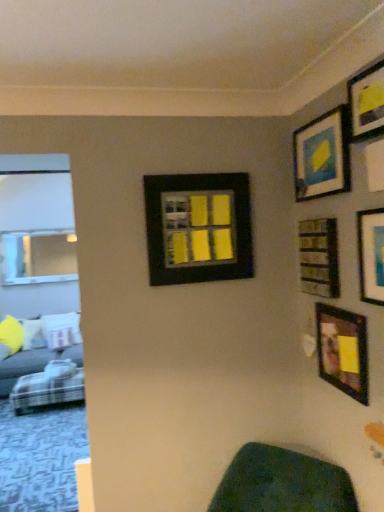
Question: Does black matte picture frame at center, which is counted as the sixth picture frame, starting from the right, have a lesser width compared to plaid fabric couch at lower left?

Choices:
 (A) no
 (B) yes

Answer: (B)

Question: Is black matte picture frame at center, the 1th picture frame in the left-to-right sequence, positioned before plaid fabric couch at lower left?

Choices:
 (A) no
 (B) yes

Answer: (B)

Question: Considering the relative sizes of black matte picture frame at center, which is counted as the sixth picture frame, starting from the right, and plaid fabric couch at lower left in the image provided, is black matte picture frame at center, which is counted as the sixth picture frame, starting from the right, taller than plaid fabric couch at lower left?

Choices:
 (A) no
 (B) yes

Answer: (B)

Question: Is black matte picture frame at center, which is counted as the sixth picture frame, starting from the right, not close to plaid fabric couch at lower left?

Choices:
 (A) no
 (B) yes

Answer: (B)

Question: Is black matte picture frame at center, the 1th picture frame in the left-to-right sequence, aimed at plaid fabric couch at lower left?

Choices:
 (A) yes
 (B) no

Answer: (B)

Question: Is black matte picture frame at center, the 1th picture frame in the left-to-right sequence, positioned with its back to plaid fabric couch at lower left?

Choices:
 (A) yes
 (B) no

Answer: (B)

Question: Is matte black picture frame at upper right, which appears as the second picture frame when viewed from the right, at the back of matte black picture frame at upper right, the 5th picture frame in the right-to-left sequence?

Choices:
 (A) yes
 (B) no

Answer: (B)

Question: Is matte black picture frame at upper right, which is counted as the second picture frame, starting from the left, at the left side of matte black picture frame at upper right, which appears as the second picture frame when viewed from the right?

Choices:
 (A) no
 (B) yes

Answer: (B)

Question: From a real-world perspective, is matte black picture frame at upper right, the 5th picture frame in the right-to-left sequence, below matte black picture frame at upper right, placed as the fifth picture frame when sorted from left to right?

Choices:
 (A) no
 (B) yes

Answer: (B)

Question: Is matte black picture frame at upper right, which is counted as the second picture frame, starting from the left, directly adjacent to matte black picture frame at upper right, which appears as the second picture frame when viewed from the right?

Choices:
 (A) no
 (B) yes

Answer: (A)

Question: From a real-world perspective, is matte black picture frame at upper right, which is counted as the second picture frame, starting from the left, over matte black picture frame at upper right, which appears as the second picture frame when viewed from the right?

Choices:
 (A) yes
 (B) no

Answer: (B)

Question: Can you confirm if matte black picture frame at upper right, which is counted as the second picture frame, starting from the left, is smaller than matte black picture frame at upper right, which appears as the second picture frame when viewed from the right?

Choices:
 (A) yes
 (B) no

Answer: (B)

Question: Is wooden frame at lower right, the 4th picture frame when ordered from left to right, bigger than black matte picture frame at center, the 1th picture frame in the left-to-right sequence?

Choices:
 (A) no
 (B) yes

Answer: (A)